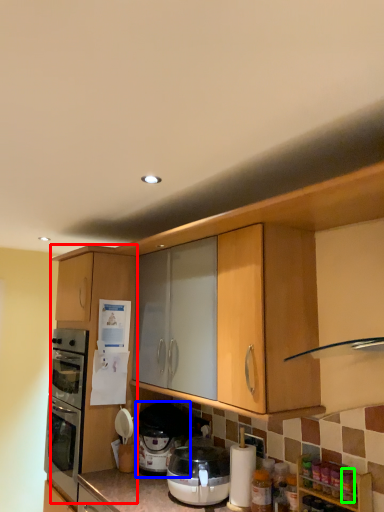
Question: Which object is the closest to the cabinetry (highlighted by a red box)? Choose among these: pressure cooker (highlighted by a blue box) or bottle (highlighted by a green box).

Choices:
 (A) pressure cooker
 (B) bottle

Answer: (A)